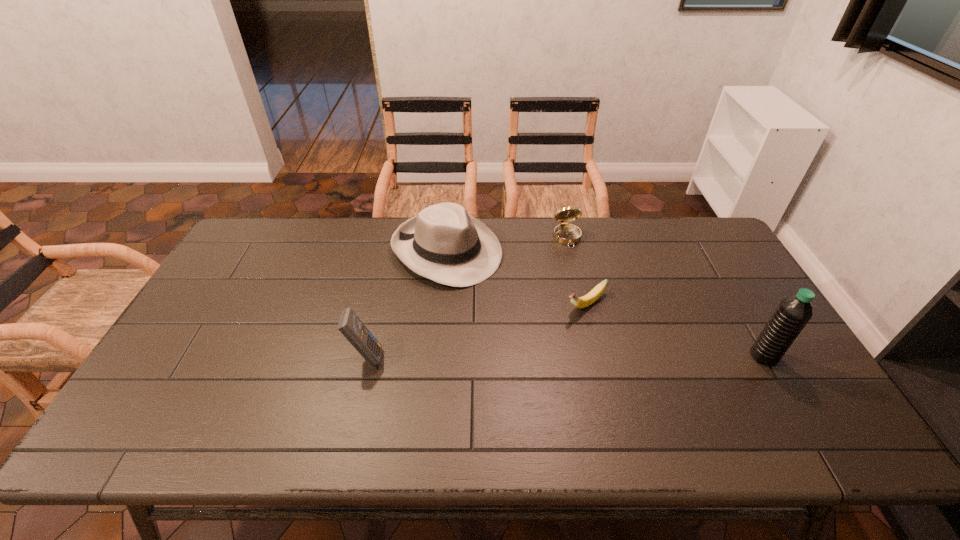
Where is `free space on the desktop that is between the calculator and the rightmost object and is positioned at the stem of the shortest object`? The image size is (960, 540). free space on the desktop that is between the calculator and the rightmost object and is positioned at the stem of the shortest object is located at coordinates (513, 356).

Where is `free space on the desktop that is between the calculator and the tallest object and is positioned on the front-facing side of the fedora`? free space on the desktop that is between the calculator and the tallest object and is positioned on the front-facing side of the fedora is located at coordinates (608, 356).

This screenshot has width=960, height=540. Identify the location of vacant space on the desktop that is between the calculator and the tallest object and is positioned with the dial facing the second shortest object. (611, 356).